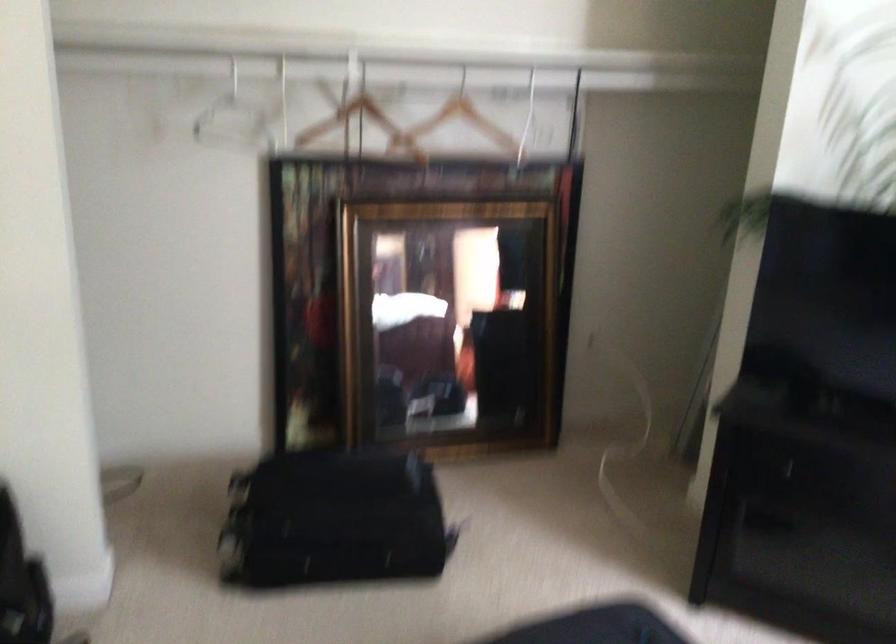
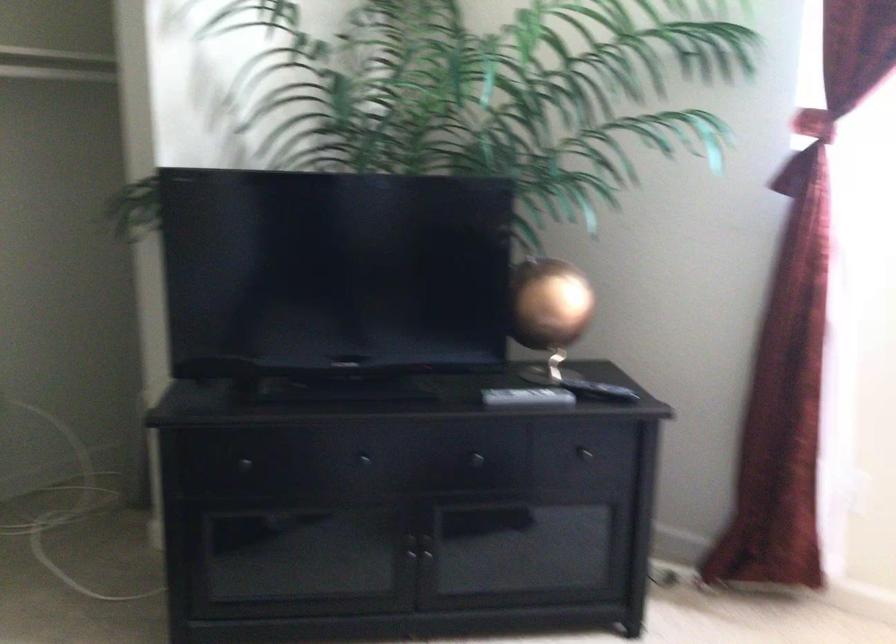
Find the pixel in the second image that matches (745,451) in the first image.

(239, 464)